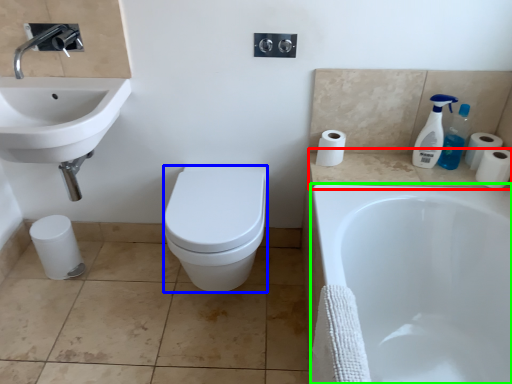
Question: Estimate the real-world distances between objects in this image. Which object is closer to counter top (highlighted by a red box), bidet (highlighted by a blue box) or bathtub (highlighted by a green box)?

Choices:
 (A) bidet
 (B) bathtub

Answer: (B)